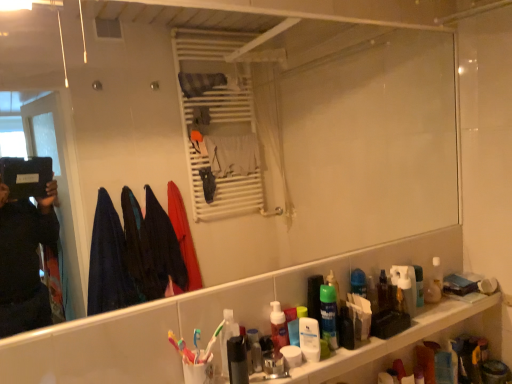
Question: Would you say translucent plastic shelf at lower right is to the left or to the right of brown plastic bottle at lower right, the third mouthwash positioned from the right, in the picture?

Choices:
 (A) left
 (B) right

Answer: (A)

Question: In terms of height, does translucent plastic shelf at lower right look taller or shorter compared to brown plastic bottle at lower right, the 5th mouthwash viewed from the front?

Choices:
 (A) short
 (B) tall

Answer: (A)

Question: Which of these objects is positioned closest to the clear plastic mouthwash at right, placed as the 6th mouthwash when sorted from front to back?

Choices:
 (A) multicolored plastic toothbrush at lower center, acting as the first toothbrush starting from the left
 (B) translucent plastic mouthwash at shelf center, arranged as the sixth mouthwash when viewed from the right
 (C) brown plastic bottle at lower right, the 5th mouthwash viewed from the front
 (D) translucent plastic toothbrush at lower center, the first toothbrush when ordered from right to left
 (E) translucent plastic mouthwash at shelf center, which ranks as the first mouthwash in left-to-right order

Answer: (C)

Question: Estimate the real-world distances between objects in this image. Which object is closer to the translucent plastic mouthwash at shelf center, the second mouthwash viewed from the left?

Choices:
 (A) white plastic mouthwash at lower center, which is counted as the first mouthwash, starting from the front
 (B) white matte toothpaste at center
 (C) multicolored plastic toothbrush at lower center, acting as the first toothbrush starting from the left
 (D) translucent plastic toothbrush at lower center, the 2th toothbrush viewed from the left
 (E) clear plastic mouthwash at right, placed as the 6th mouthwash when sorted from left to right

Answer: (A)